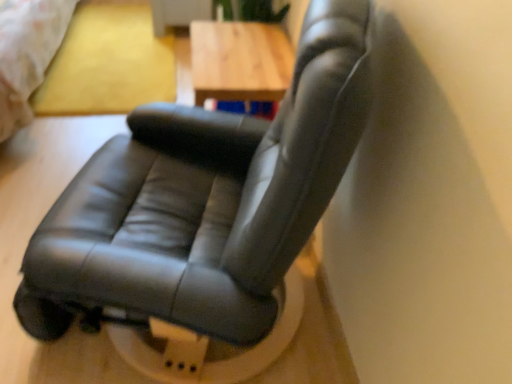
Where is `blank space situated above black leather chair at center (from a real-world perspective)`? The image size is (512, 384). blank space situated above black leather chair at center (from a real-world perspective) is located at coordinates (117, 61).